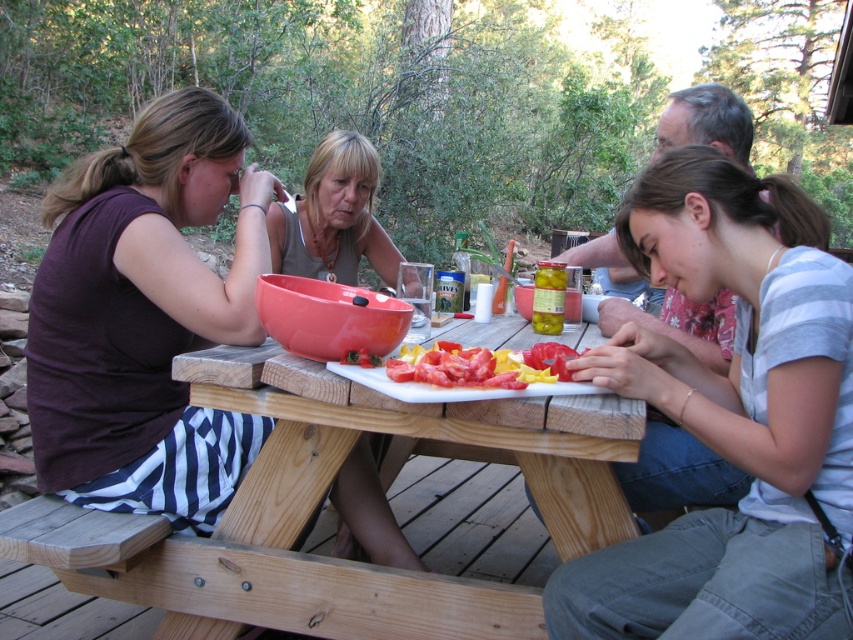
Who is more distant from viewer, [251,396] or [381,266]?

Positioned behind is point [381,266].

Which is in front, point (416, 412) or point (375, 488)?

Point (416, 412) is more forward.

Who is more distant from viewer, (405, 417) or (322, 176)?

The point (322, 176) is behind.

This screenshot has width=853, height=640. I want to click on wooden picnic table at center, so point(415,436).

Which is in front, point (558, 509) or point (535, 380)?

Point (535, 380) is in front.

Does wooden picnic table at center have a greater width compared to sliced red tomato at center?

Yes, wooden picnic table at center is wider than sliced red tomato at center.

Which is behind, point (279, 400) or point (480, 378)?

The point (279, 400) is behind.

Identify the location of wooden picnic table at center. (415, 436).

Who is lower down, matte pink bowl at center or sliced red tomato at center?

Positioned lower is sliced red tomato at center.

In order to click on matte pink bowl at center in this screenshot , I will do `click(334, 216)`.

Between point (369, 481) and point (444, 340), which one is positioned behind?

The point (369, 481) is behind.

At what (x,y) coordinates should I click in order to perform the action: click on matte pink bowl at center. Please return your answer as a coordinate pair (x, y). The image size is (853, 640). Looking at the image, I should click on (334, 216).